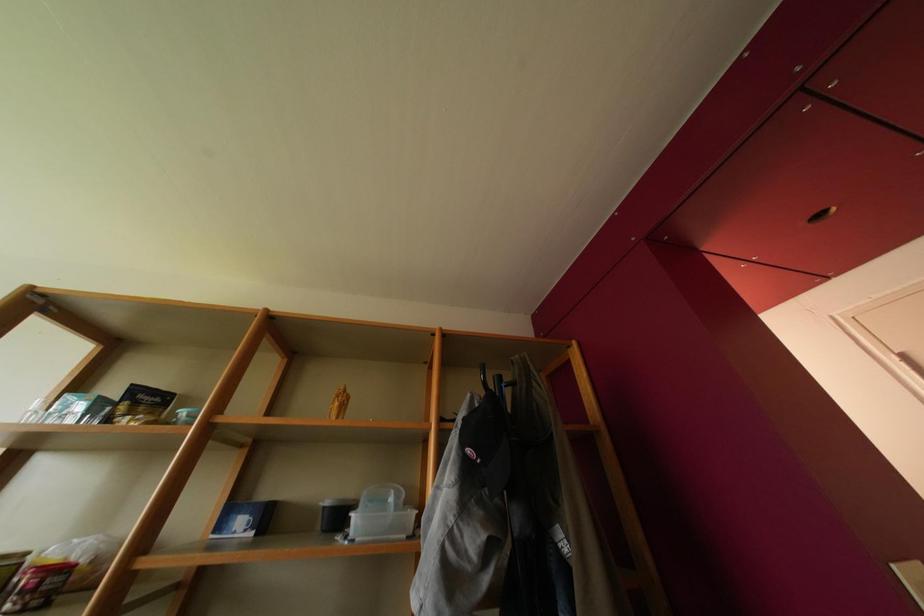
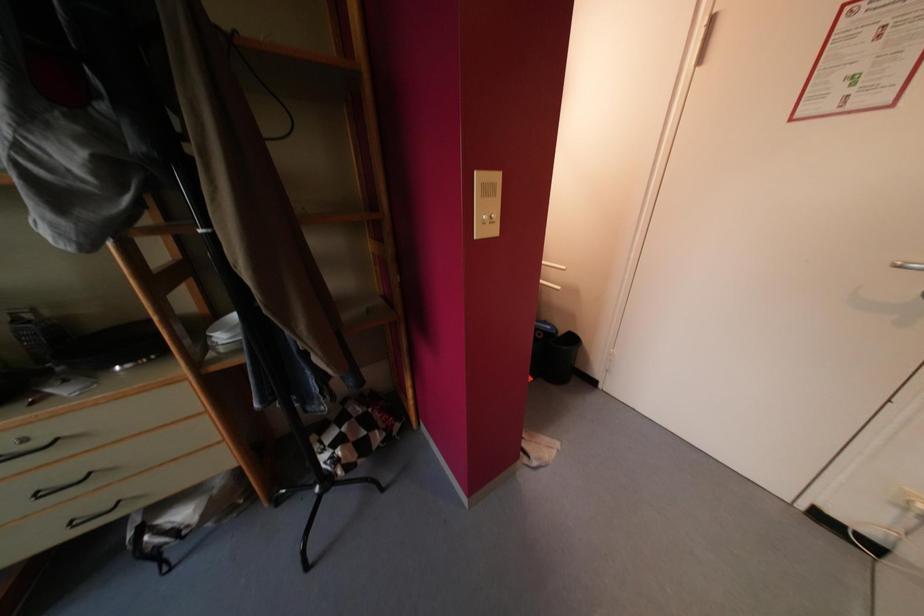
First-person continuous shooting, in which direction is the camera rotating?

The rotation direction of the camera is right-down.